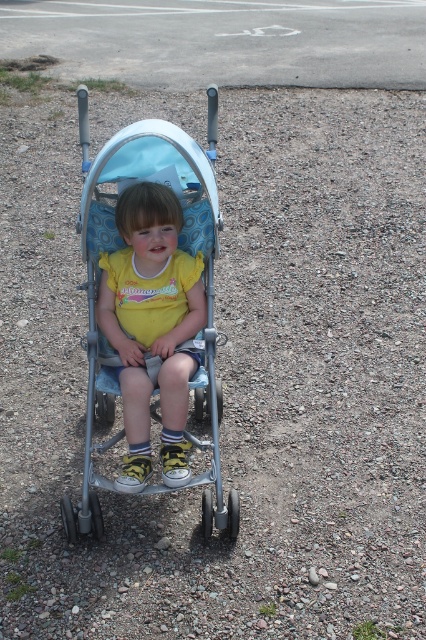
Can you confirm if metallic silver stroller at center is positioned to the left of yellow matte shirt at center?

Yes, metallic silver stroller at center is to the left of yellow matte shirt at center.

What are the coordinates of `metallic silver stroller at center` in the screenshot? It's located at (95, 298).